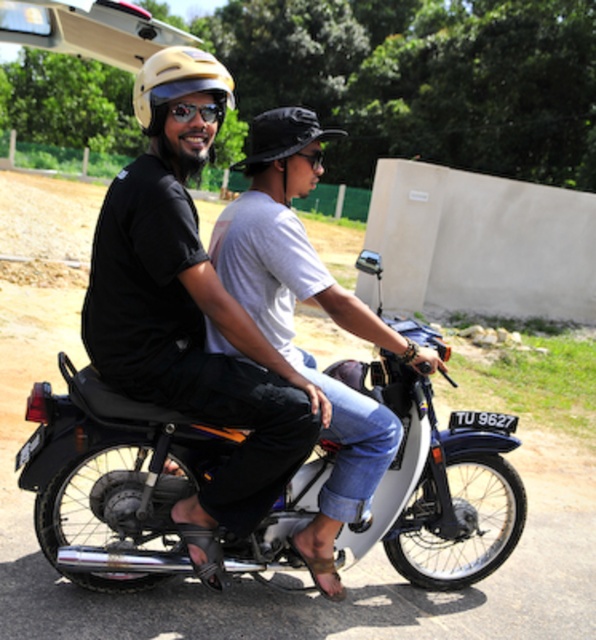
Question: Can you confirm if matte yellow helmet at upper left is positioned above black matte bucket hat at center?

Choices:
 (A) no
 (B) yes

Answer: (B)

Question: Is matte black helmet at upper left thinner than matte yellow helmet at upper left?

Choices:
 (A) no
 (B) yes

Answer: (B)

Question: Which of the following is the farthest from the observer?

Choices:
 (A) (209, 113)
 (B) (367, 424)

Answer: (B)

Question: Does matte black helmet at upper left appear under black matte bucket hat at center?

Choices:
 (A) no
 (B) yes

Answer: (B)

Question: Among these points, which one is nearest to the camera?

Choices:
 (A) (185, 118)
 (B) (123, 202)

Answer: (B)

Question: Which point appears farthest from the camera in this image?

Choices:
 (A) (222, 113)
 (B) (302, 161)
 (C) (175, 72)

Answer: (B)